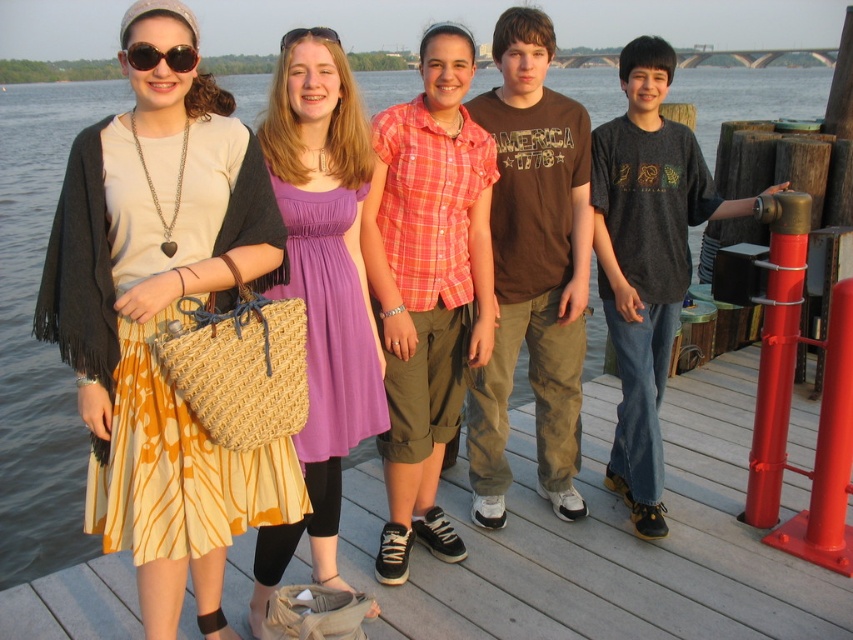
Question: Can you confirm if wooden deck at center is positioned to the left of purple satin dress at center?

Choices:
 (A) no
 (B) yes

Answer: (A)

Question: Which object is positioned closest to the sunglasses at upper left?

Choices:
 (A) clear plastic goggles at upper center
 (B) brown cotton shirt at center

Answer: (A)

Question: Does brown cotton shirt at center lie in front of sunglasses at upper left?

Choices:
 (A) yes
 (B) no

Answer: (B)

Question: From the image, what is the correct spatial relationship of purple satin dress at center in relation to clear plastic goggles at upper center?

Choices:
 (A) right
 (B) left

Answer: (A)

Question: Which of the following is the farthest from the observer?

Choices:
 (A) printed fabric skirt at left
 (B) clear plastic goggles at upper center
 (C) dark gray t-shirt at center
 (D) brown cotton shirt at center

Answer: (C)

Question: Based on their relative distances, which object is nearer to the clear plastic goggles at upper center?

Choices:
 (A) printed fabric skirt at left
 (B) brown cotton shirt at center
 (C) purple satin dress at center

Answer: (C)